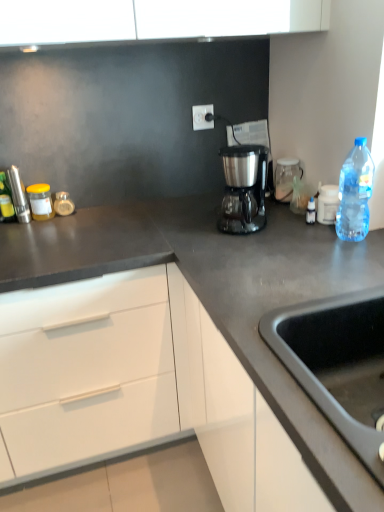
Identify the location of vacant space in front of transparent glass jar at upper right. The image size is (384, 512). (280, 214).